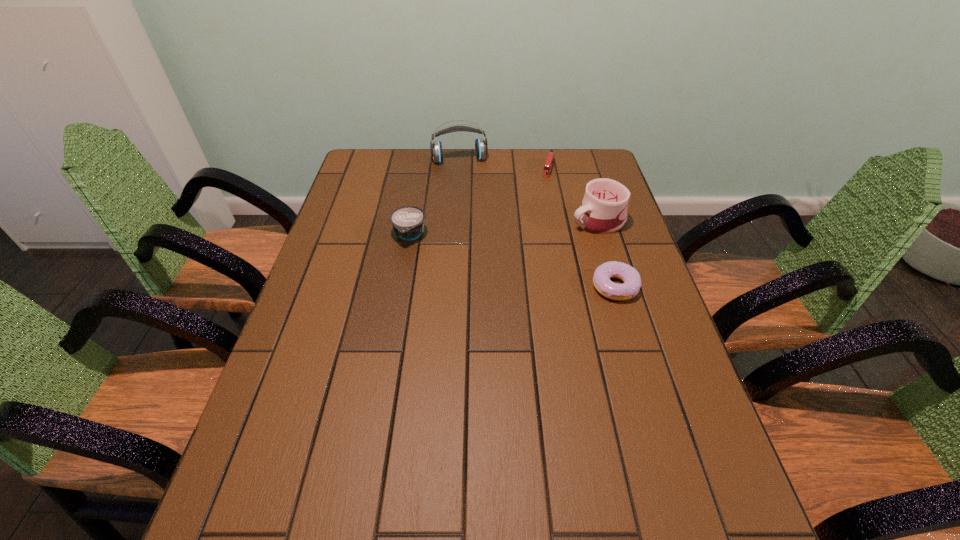
Find the location of a particular element. The width and height of the screenshot is (960, 540). free point between the second tallest object and the third tallest object is located at coordinates coord(504,228).

Where is `vacant space in between the headset and the nearest object`? This screenshot has height=540, width=960. vacant space in between the headset and the nearest object is located at coordinates (538, 223).

Find the location of a particular element. The width and height of the screenshot is (960, 540). free space between the tallest object and the second tallest object is located at coordinates (529, 190).

Where is `vacant area that lies between the nearest object and the third shortest object`? Image resolution: width=960 pixels, height=540 pixels. vacant area that lies between the nearest object and the third shortest object is located at coordinates (513, 261).

Locate which object ranks third in proximity to the headset. Please provide its 2D coordinates. Your answer should be formatted as a tuple, i.e. [(x, y)], where the tuple contains the x and y coordinates of a point satisfying the conditions above.

[(603, 210)]

This screenshot has width=960, height=540. Identify the location of object that can be found as the fourth closest to the fourth shortest object. (408, 222).

The image size is (960, 540). I want to click on blank area in the image that satisfies the following two spatial constraints: 1. on the front side of the yogurt; 2. on the left side of the nearest object, so click(x=400, y=287).

Find the location of a particular element. The width and height of the screenshot is (960, 540). free space that satisfies the following two spatial constraints: 1. on the back side of the tallest object; 2. on the left side of the yogurt is located at coordinates (422, 160).

Identify the location of vacant space that satisfies the following two spatial constraints: 1. on the back side of the mug; 2. on the left side of the nearest object. (595, 220).

The width and height of the screenshot is (960, 540). Identify the location of vacant space that satisfies the following two spatial constraints: 1. on the front side of the nearest object; 2. on the left side of the stapler. (573, 287).